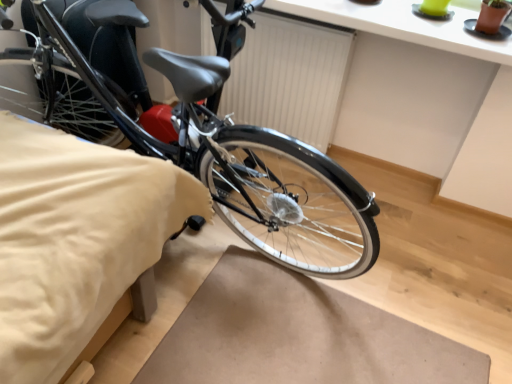
What do you see at coordinates (75, 239) in the screenshot? I see `beige fabric bedsheet at lower left` at bounding box center [75, 239].

At what (x,y) coordinates should I click in order to perform the action: click on shiny black bicycle at left. Please return your answer as a coordinate pair (x, y). The height and width of the screenshot is (384, 512). Looking at the image, I should click on (199, 132).

Between point (92, 6) and point (279, 112), which one is positioned behind?

The point (279, 112) is farther from the camera.

From a real-world perspective, is shiny black bicycle at left physically below white matte radiator at center?

Incorrect, from a real-world perspective, shiny black bicycle at left is higher than white matte radiator at center.

How different are the orientations of shiny black bicycle at left and white matte radiator at center in degrees?

The angular difference between shiny black bicycle at left and white matte radiator at center is 85.6 degrees.

Considering the relative sizes of shiny black bicycle at left and white matte radiator at center in the image provided, is shiny black bicycle at left thinner than white matte radiator at center?

In fact, shiny black bicycle at left might be wider than white matte radiator at center.

You are a GUI agent. You are given a task and a screenshot of the screen. Output one action in this format:
    pyautogui.click(x=<x>, y=<y>)
    Task: Click on the bicycle on the left of white matte radiator at center
    This screenshot has width=512, height=384.
    Given the screenshot: What is the action you would take?
    pyautogui.click(x=199, y=132)

Which object is positioned more to the right, white matte radiator at center or shiny black bicycle at left?

white matte radiator at center.

Is point (258, 96) closer to camera compared to point (275, 197)?

No.

Is shiny black bicycle at left situated inside beige fabric bedsheet at lower left or outside?

shiny black bicycle at left exists outside the volume of beige fabric bedsheet at lower left.

Is shiny black bicycle at left positioned far away from beige fabric bedsheet at lower left?

No, shiny black bicycle at left is not far from beige fabric bedsheet at lower left.

Is white matte radiator at center bigger than beige fabric bedsheet at lower left?

Incorrect, white matte radiator at center is not larger than beige fabric bedsheet at lower left.

Is white matte radiator at center wider or thinner than beige fabric bedsheet at lower left?

Considering their sizes, white matte radiator at center looks slimmer than beige fabric bedsheet at lower left.

Image resolution: width=512 pixels, height=384 pixels. I want to click on sheet located underneath the white matte radiator at center (from a real-world perspective), so click(x=75, y=239).

How many degrees apart are the facing directions of white matte radiator at center and beige fabric bedsheet at lower left?

1.45 degrees separate the facing orientations of white matte radiator at center and beige fabric bedsheet at lower left.

From a real-world perspective, is beige fabric bedsheet at lower left positioned over shiny black bicycle at left based on gravity?

No, from a real-world perspective, beige fabric bedsheet at lower left is not over shiny black bicycle at left

Does beige fabric bedsheet at lower left have a greater width compared to shiny black bicycle at left?

Incorrect, the width of beige fabric bedsheet at lower left does not surpass that of shiny black bicycle at left.

Is point (162, 172) behind point (96, 96)?

No.

From the image's perspective, who appears lower, beige fabric bedsheet at lower left or shiny black bicycle at left?

beige fabric bedsheet at lower left is shown below in the image.

Considering the relative sizes of beige fabric bedsheet at lower left and white matte radiator at center in the image provided, is beige fabric bedsheet at lower left smaller than white matte radiator at center?

No.

Image resolution: width=512 pixels, height=384 pixels. What are the coordinates of `radiator above the beige fabric bedsheet at lower left (from the image's perspective)` in the screenshot? It's located at (289, 77).

Between beige fabric bedsheet at lower left and white matte radiator at center, which one has larger width?

Wider between the two is beige fabric bedsheet at lower left.

Is beige fabric bedsheet at lower left aimed at white matte radiator at center?

No, beige fabric bedsheet at lower left is not facing towards white matte radiator at center.

In the image, there is a shiny black bicycle at left. Identify the location of radiator below it (from a real-world perspective). This screenshot has height=384, width=512. (289, 77).

Image resolution: width=512 pixels, height=384 pixels. What are the coordinates of `radiator that appears behind the shiny black bicycle at left` in the screenshot? It's located at (289, 77).

Based on their spatial positions, is shiny black bicycle at left or beige fabric bedsheet at lower left closer to white matte radiator at center?

shiny black bicycle at left is closer to white matte radiator at center.

From the image, which object appears to be farther from beige fabric bedsheet at lower left, shiny black bicycle at left or white matte radiator at center?

Among the two, white matte radiator at center is located further to beige fabric bedsheet at lower left.

Looking at this image, based on their spatial positions, is beige fabric bedsheet at lower left or white matte radiator at center closer to shiny black bicycle at left?

beige fabric bedsheet at lower left is positioned closer to the anchor shiny black bicycle at left.

Considering their positions, is beige fabric bedsheet at lower left positioned further to white matte radiator at center than shiny black bicycle at left?

Answer: Based on the image, beige fabric bedsheet at lower left appears to be further to white matte radiator at center.

Considering their positions, is white matte radiator at center positioned further to beige fabric bedsheet at lower left than shiny black bicycle at left?

white matte radiator at center is further to beige fabric bedsheet at lower left.

When comparing their distances from shiny black bicycle at left, does white matte radiator at center or beige fabric bedsheet at lower left seem closer?

beige fabric bedsheet at lower left is positioned closer to the anchor shiny black bicycle at left.

Image resolution: width=512 pixels, height=384 pixels. Find the location of `bicycle between beige fabric bedsheet at lower left and white matte radiator at center in the front-back direction`. bicycle between beige fabric bedsheet at lower left and white matte radiator at center in the front-back direction is located at coordinates (199, 132).